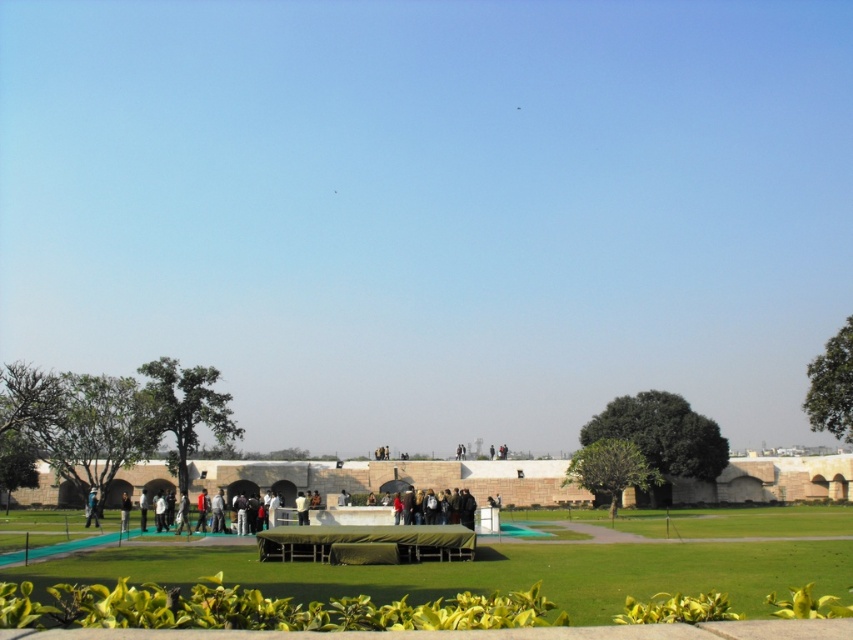
Looking at this image, which of these two, dark gray fabric at center or light blue fabric at center, stands taller?

dark gray fabric at center is taller.

Which is in front, point (422, 518) or point (91, 518)?

Positioned in front is point (422, 518).

Image resolution: width=853 pixels, height=640 pixels. Identify the location of dark gray fabric at center. (451, 508).

Can you confirm if dark gray fabric at center is bigger than dark gray jacket at center?

Actually, dark gray fabric at center might be smaller than dark gray jacket at center.

Does point (468, 516) lie in front of point (120, 515)?

Yes, it is.

Is point (469, 500) positioned after point (128, 499)?

No, (469, 500) is closer to viewer.

The image size is (853, 640). I want to click on dark gray fabric at center, so click(x=451, y=508).

Which is more to the right, white fabric at center or light gray fabric at center?

white fabric at center

Does white fabric at center appear over light gray fabric at center?

Correct, white fabric at center is located above light gray fabric at center.

What are the coordinates of `white fabric at center` in the screenshot? It's located at (300, 508).

I want to click on white fabric at center, so click(x=300, y=508).